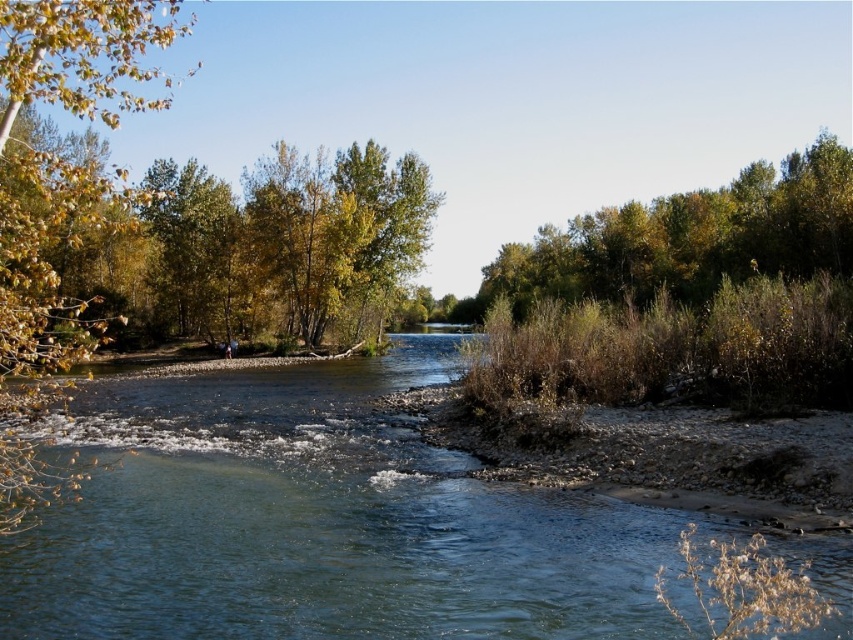
Question: Which of these objects is positioned closest to the green leafy tree at upper right?

Choices:
 (A) clear blue water at center
 (B) yellow-green leaves at left

Answer: (A)

Question: Can you confirm if yellow-green leaves at left is positioned above green leafy tree at upper right?

Choices:
 (A) yes
 (B) no

Answer: (A)

Question: Does clear blue water at center have a larger size compared to green leafy tree at upper right?

Choices:
 (A) no
 (B) yes

Answer: (A)

Question: Does clear blue water at center have a lesser width compared to yellow-green leaves at left?

Choices:
 (A) no
 (B) yes

Answer: (B)

Question: Among these objects, which one is nearest to the camera?

Choices:
 (A) green leafy tree at upper right
 (B) yellow-green leaves at left

Answer: (B)

Question: Which object is closer to the camera taking this photo?

Choices:
 (A) clear blue water at center
 (B) green leafy tree at upper right

Answer: (A)